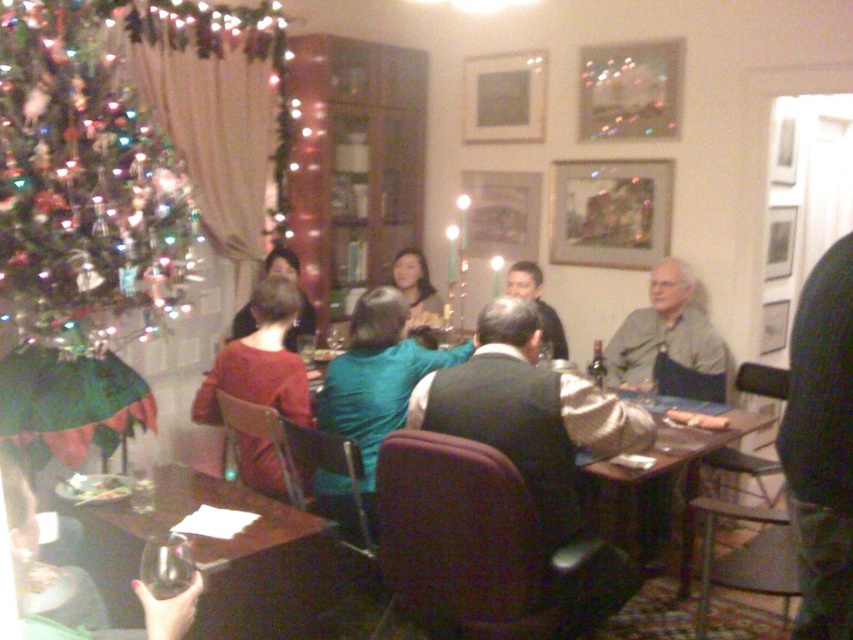
Question: Estimate the real-world distances between objects in this image. Which object is farther from the dark blue sweater at center?

Choices:
 (A) dark gray vest at center
 (B) matte brown sweater at center

Answer: (B)

Question: Is green matte christmas tree at left to the left of matte teal sweater at center from the viewer's perspective?

Choices:
 (A) no
 (B) yes

Answer: (B)

Question: Which point is farther to the camera?

Choices:
 (A) (277, 259)
 (B) (691, 467)

Answer: (A)

Question: Which object is positioned farthest from the teal fabric shirt at center?

Choices:
 (A) matte brown sweater at center
 (B) dark blue sweater at center
 (C) dark gray vest at center

Answer: (B)

Question: Where is green matte christmas tree at left located in relation to teal fabric shirt at center in the image?

Choices:
 (A) left
 (B) right

Answer: (A)

Question: Is translucent glass wine glass at lower left positioned behind teal fabric shirt at center?

Choices:
 (A) yes
 (B) no

Answer: (B)